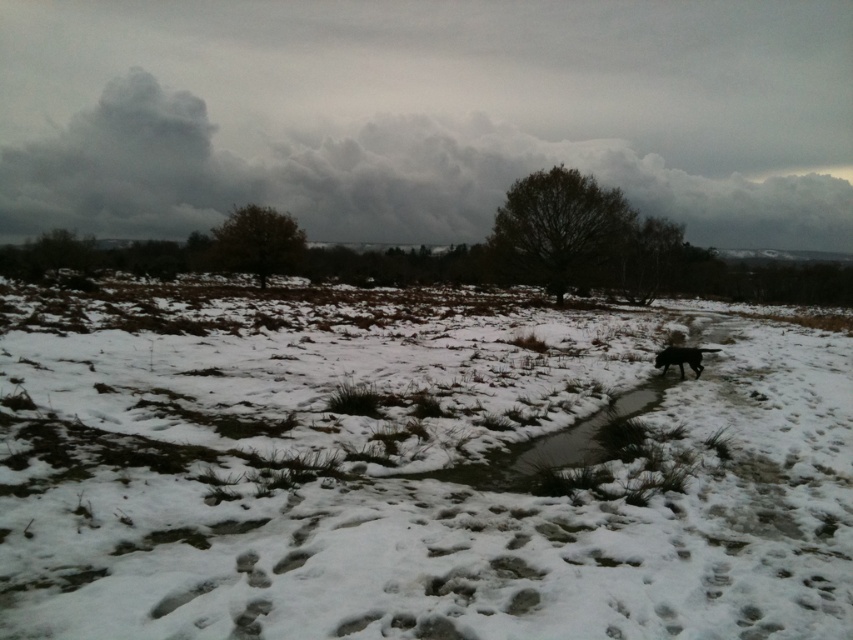
Question: Which of the following is the farthest from the observer?

Choices:
 (A) (682, 376)
 (B) (602, 349)

Answer: (B)

Question: Is the position of white fluffy snow at center more distant than that of black matte dog at right?

Choices:
 (A) yes
 (B) no

Answer: (B)

Question: Considering the relative positions of white fluffy snow at center and black matte dog at right in the image provided, where is white fluffy snow at center located with respect to black matte dog at right?

Choices:
 (A) below
 (B) above

Answer: (B)

Question: Which point is farther to the camera?

Choices:
 (A) black matte dog at right
 (B) white fluffy snow at center

Answer: (A)

Question: Is white fluffy snow at center closer to the viewer compared to black matte dog at right?

Choices:
 (A) yes
 (B) no

Answer: (A)

Question: Which of the following is the closest to the observer?

Choices:
 (A) white fluffy snow at center
 (B) black matte dog at right

Answer: (A)